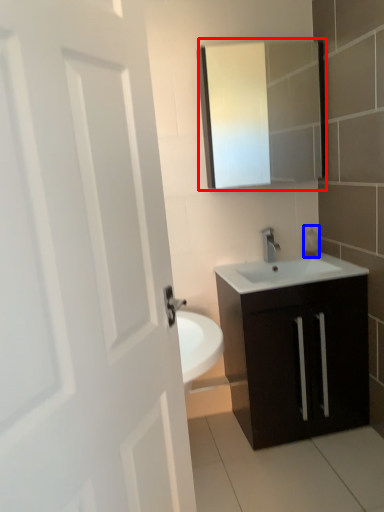
Question: Which of the following is the closest to the observer, medicine cabinet (highlighted by a red box) or soap dispenser (highlighted by a blue box)?

Choices:
 (A) medicine cabinet
 (B) soap dispenser

Answer: (A)